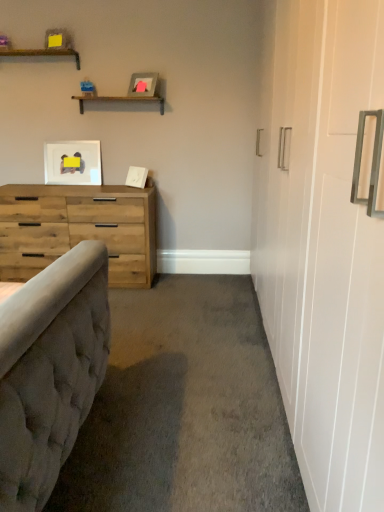
Question: Considering the positions of matte white picture frame at upper left, acting as the second picture frame starting from the front, and wooden shelf at upper left, acting as the second shelf starting from the bottom, in the image, is matte white picture frame at upper left, acting as the second picture frame starting from the front, wider or thinner than wooden shelf at upper left, acting as the second shelf starting from the bottom,?

Choices:
 (A) wide
 (B) thin

Answer: (B)

Question: From the image's perspective, is matte white picture frame at upper left, acting as the second picture frame starting from the right, positioned above or below wooden shelf at upper left, acting as the second shelf starting from the bottom?

Choices:
 (A) below
 (B) above

Answer: (A)

Question: Which object is positioned closest to the matte gray picture frame at upper center, the second picture frame when ordered from left to right?

Choices:
 (A) natural wood dresser at left
 (B) wooden shelf at upper center, which is the 2th shelf in left-to-right order
 (C) matte white picture frame at upper left, placed as the first picture frame when sorted from left to right
 (D) wooden shelf at upper left, which is the 2th shelf in right-to-left order

Answer: (B)

Question: Estimate the real-world distances between objects in this image. Which object is farther from the wooden shelf at upper center, which is the first shelf from right to left?

Choices:
 (A) natural wood dresser at left
 (B) matte gray picture frame at upper center, the second picture frame when ordered from left to right
 (C) wooden shelf at upper left, which is the first shelf in top-to-bottom order
 (D) matte white picture frame at upper left, arranged as the 2th picture frame when viewed from the top

Answer: (A)